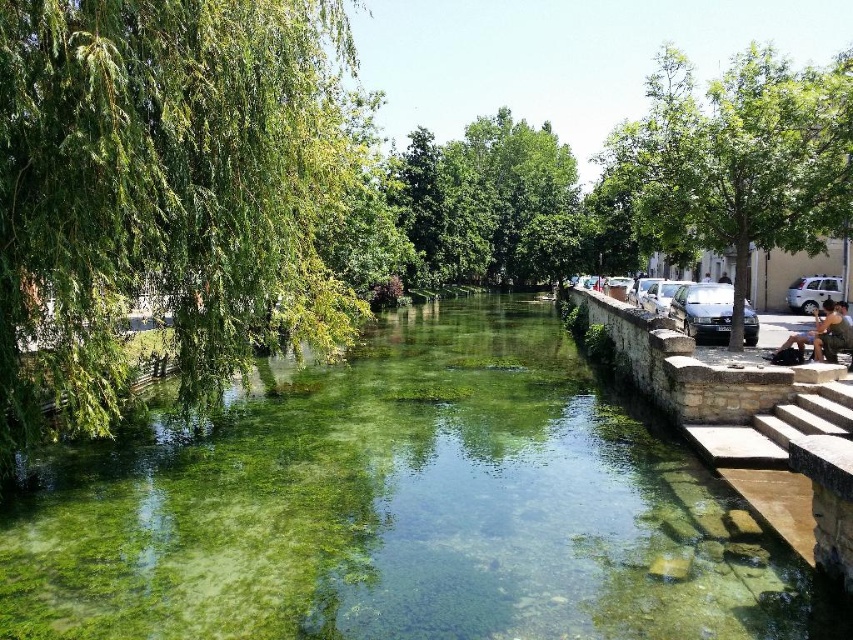
You are standing at the edge of the canal and want to take a photo that includes both the green leafy tree at left and the gray stone stairs at right. Which object should you position closer to the center of your camera frame to ensure both are fully visible?

Since the green leafy tree at left is smaller than the gray stone stairs at right, you should position the gray stone stairs at right closer to the center of your camera frame to ensure both are fully visible.

You are standing at the edge of the canal and notice two points marked in the scene. Which of the two points, point [722,426] or point [819,316], is closer to you?

Point [722,426] is closer to the viewer than point [819,316].